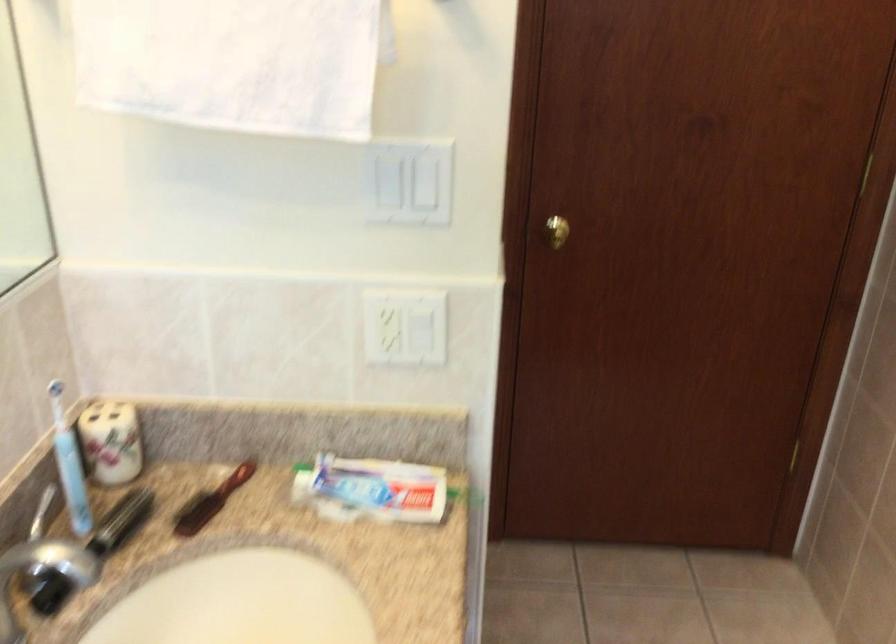
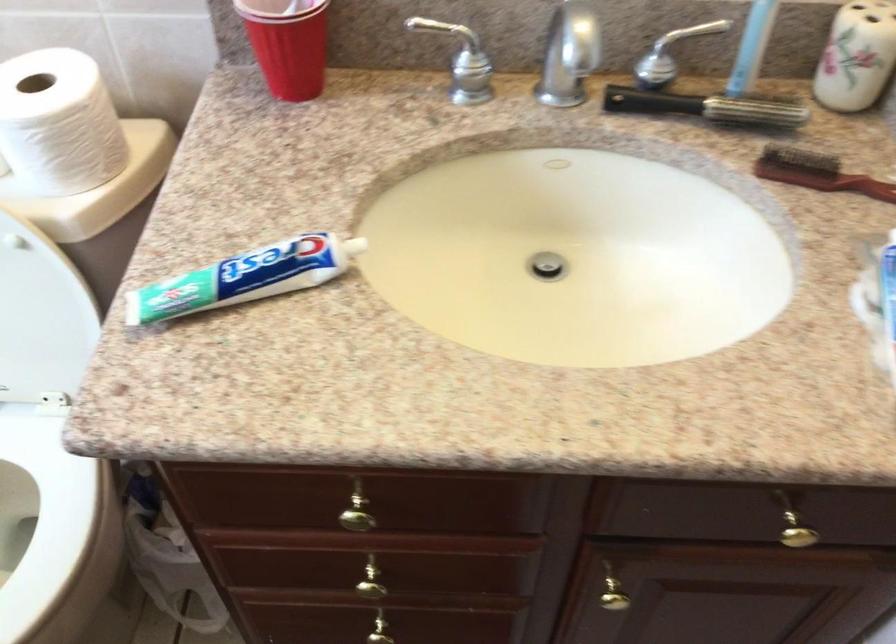
The point at (x=73, y=486) is marked in the first image. Where is the corresponding point in the second image?

(752, 46)